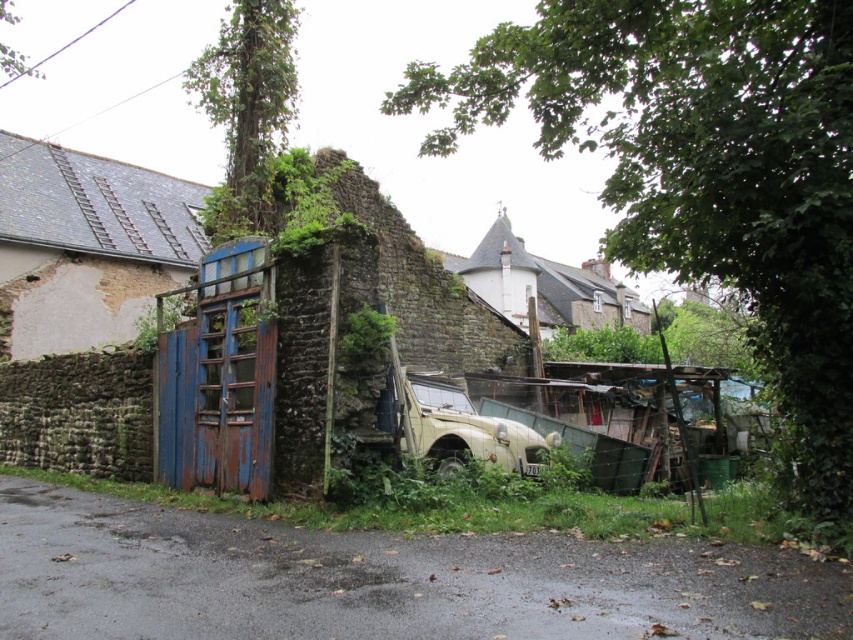
Question: Can you confirm if green leafy ivy at lower center is positioned to the right of green matte car at center?

Choices:
 (A) yes
 (B) no

Answer: (A)

Question: Among these points, which one is farthest from the camera?

Choices:
 (A) (498, 429)
 (B) (352, 316)
 (C) (726, 51)

Answer: (A)

Question: Does green leafy ivy at lower center have a lesser width compared to green matte car at center?

Choices:
 (A) no
 (B) yes

Answer: (A)

Question: Is green matte car at center to the left of green leafy weed at center from the viewer's perspective?

Choices:
 (A) yes
 (B) no

Answer: (B)

Question: Among these points, which one is nearest to the camera?

Choices:
 (A) (498, 88)
 (B) (380, 332)
 (C) (474, 440)

Answer: (B)

Question: Which object appears farthest from the camera in this image?

Choices:
 (A) green leafy ivy at lower center
 (B) green leafy weed at center

Answer: (B)